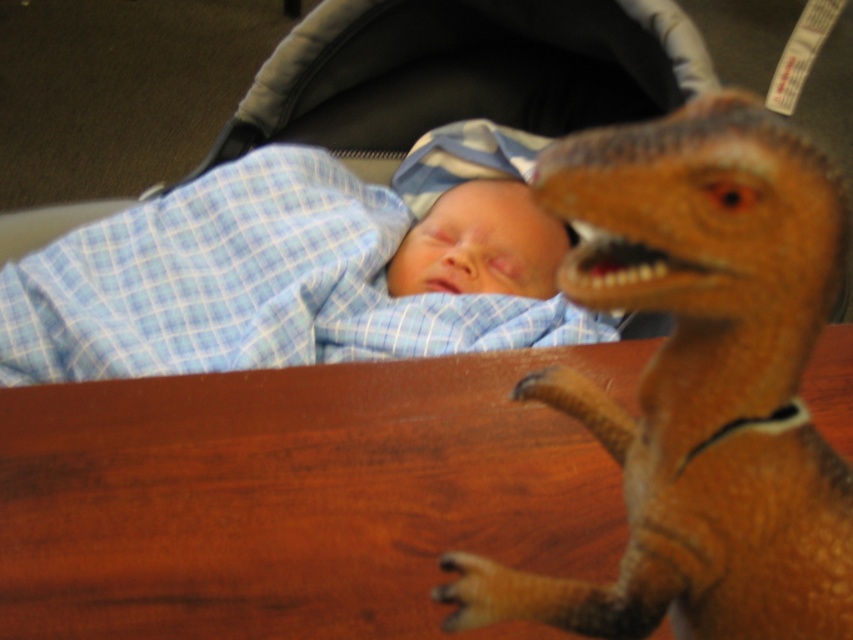
Question: Which point appears closest to the camera in this image?

Choices:
 (A) click(x=402, y=312)
 (B) click(x=746, y=284)

Answer: (B)

Question: Is brown wood table at center thinner than brown textured dinosaur at center?

Choices:
 (A) no
 (B) yes

Answer: (A)

Question: Does brown textured dinosaur at center appear on the right side of blue checkered blanket at upper left?

Choices:
 (A) no
 (B) yes

Answer: (B)

Question: Which point is closer to the camera taking this photo?

Choices:
 (A) (813, 323)
 (B) (33, 580)
 (C) (505, 337)

Answer: (A)

Question: Which of the following is the farthest from the observer?

Choices:
 (A) blue checkered blanket at upper left
 (B) brown textured dinosaur at center
 (C) brown wood table at center

Answer: (A)

Question: Does brown textured dinosaur at center have a greater width compared to blue checkered blanket at upper left?

Choices:
 (A) no
 (B) yes

Answer: (A)